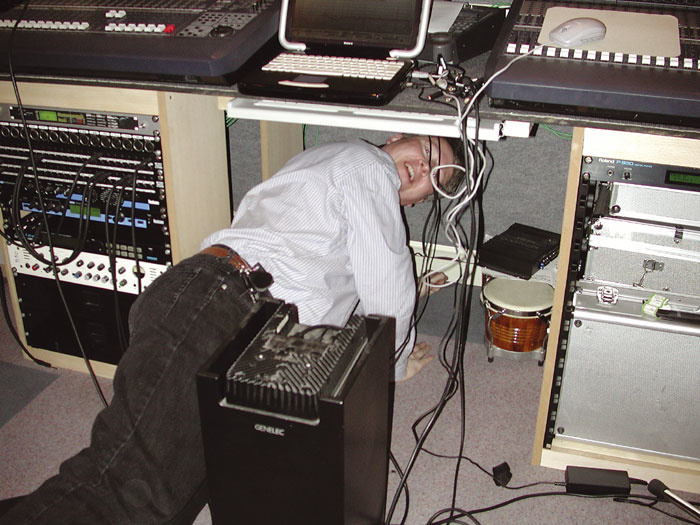
What are the coordinates of `computer mouse` in the screenshot? It's located at (584, 27).